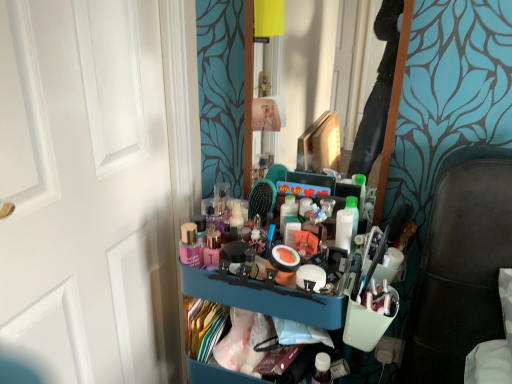
Question: Can you confirm if blue plastic tray at center is taller than white matte door at left?

Choices:
 (A) no
 (B) yes

Answer: (A)

Question: From a real-world perspective, is blue plastic tray at center positioned under white matte door at left based on gravity?

Choices:
 (A) no
 (B) yes

Answer: (B)

Question: From a real-world perspective, is blue plastic tray at center on top of white matte door at left?

Choices:
 (A) yes
 (B) no

Answer: (B)

Question: Is blue plastic tray at center touching white matte door at left?

Choices:
 (A) no
 (B) yes

Answer: (A)

Question: Can you confirm if blue plastic tray at center is bigger than white matte door at left?

Choices:
 (A) yes
 (B) no

Answer: (B)

Question: Is blue plastic tray at center positioned with its back to white matte door at left?

Choices:
 (A) no
 (B) yes

Answer: (A)

Question: From the image's perspective, would you say blue plastic tray at center is shown under clear glass mirror at center?

Choices:
 (A) yes
 (B) no

Answer: (A)

Question: Considering the relative sizes of blue plastic tray at center and clear glass mirror at center in the image provided, is blue plastic tray at center smaller than clear glass mirror at center?

Choices:
 (A) no
 (B) yes

Answer: (A)

Question: Can you confirm if blue plastic tray at center is positioned to the right of clear glass mirror at center?

Choices:
 (A) yes
 (B) no

Answer: (B)

Question: Considering the relative sizes of blue plastic tray at center and clear glass mirror at center in the image provided, is blue plastic tray at center thinner than clear glass mirror at center?

Choices:
 (A) no
 (B) yes

Answer: (A)

Question: Is blue plastic tray at center not near clear glass mirror at center?

Choices:
 (A) yes
 (B) no

Answer: (B)

Question: Considering the relative sizes of blue plastic tray at center and clear glass mirror at center in the image provided, is blue plastic tray at center wider than clear glass mirror at center?

Choices:
 (A) no
 (B) yes

Answer: (B)

Question: Is clear glass mirror at center aimed at blue plastic bookshelf at center?

Choices:
 (A) yes
 (B) no

Answer: (B)